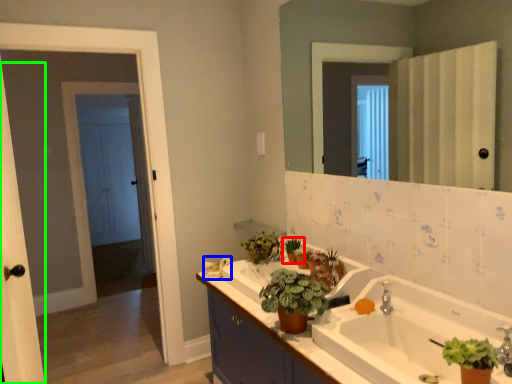
Question: Which is nearer to the houseplant (highlighted by a red box)? towel bar (highlighted by a blue box) or screen door (highlighted by a green box).

Choices:
 (A) towel bar
 (B) screen door

Answer: (A)